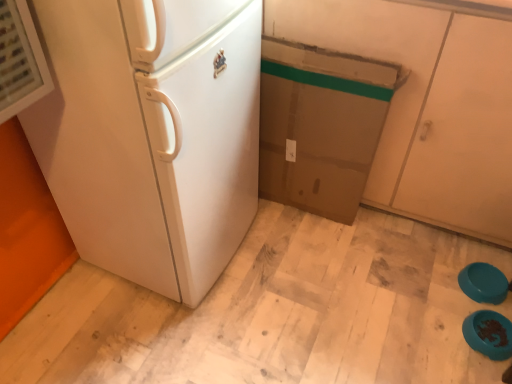
Locate an element on the screen. blank area beneath teal glossy bowls at lower right, marked as the 1th appliance in a front-to-back arrangement (from a real-world perspective) is located at coordinates (489, 334).